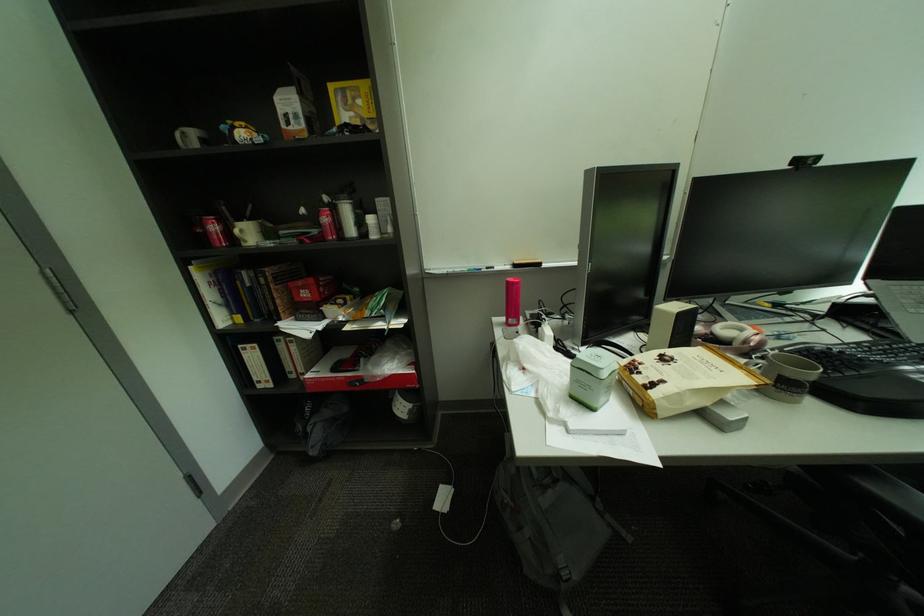
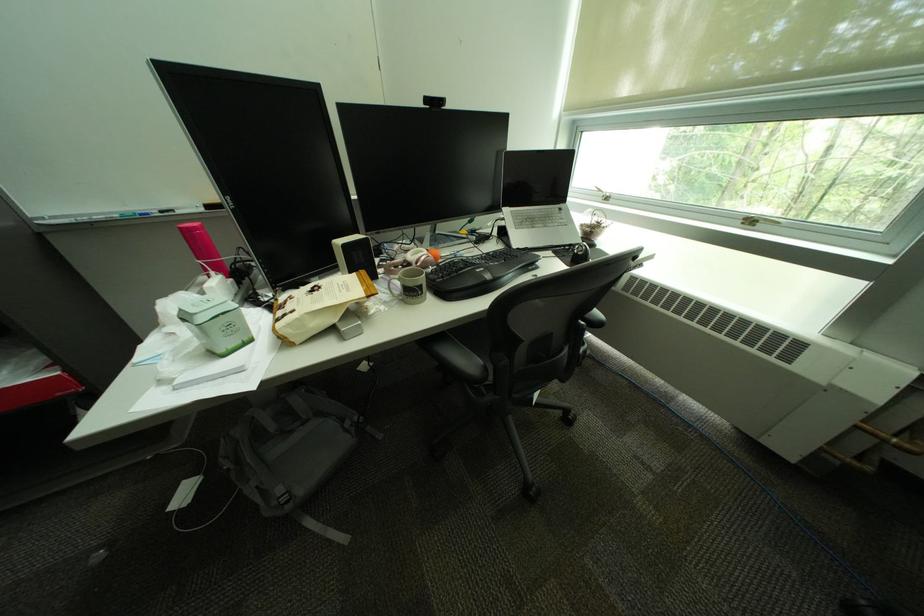
Locate, in the second image, the point that corresponds to the point at 575,586 in the first image.

(299, 508)